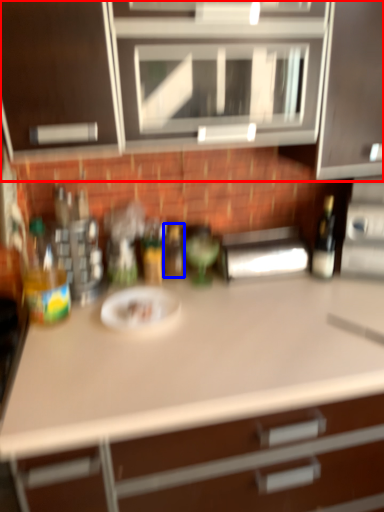
Question: Which object appears closest to the camera in this image, cabinetry (highlighted by a red box) or bottle (highlighted by a blue box)?

Choices:
 (A) cabinetry
 (B) bottle

Answer: (A)